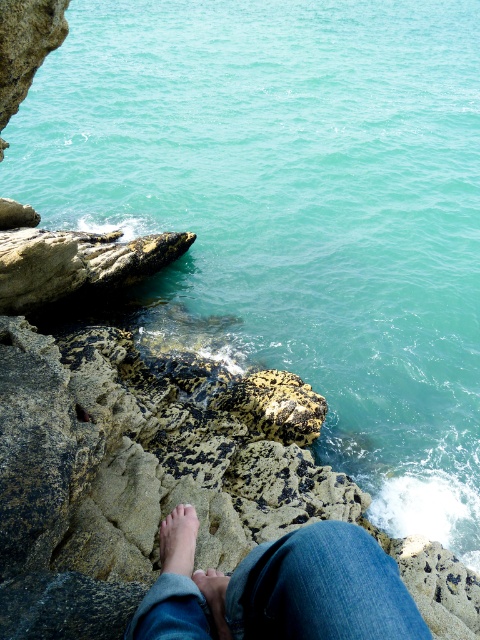
You are standing on a rocky outcrop overlooking the turquoise water. Your blue jeans at lower center are positioned at coordinates 0.922 on the x and 0.585 on the y. If you want to move to the edge of the outcrop to get a better view, which direction should you move relative to your current position?

To move to the edge of the outcrop from the blue jeans at lower center positioned at coordinates 0.922 on the x and 0.585 on the y, you should move downward since the lower center position is closer to the edge.

You are standing on the rocky outcrop with your feet at the bottom center of the frame. There is a point marked at coordinates (179, 540). What is located at that point?

Light brown skin is located at point (179, 540).

You are standing on a rocky outcrop at the coast and notice your light brown leather foot at lower center and pink flesh at center. Which part of your body is closer to the water below?

The light brown leather foot at lower center is closer to the water below because it is only 7.76 inches away from the pink flesh at center, indicating it is positioned lower down near the edge of the rocks.